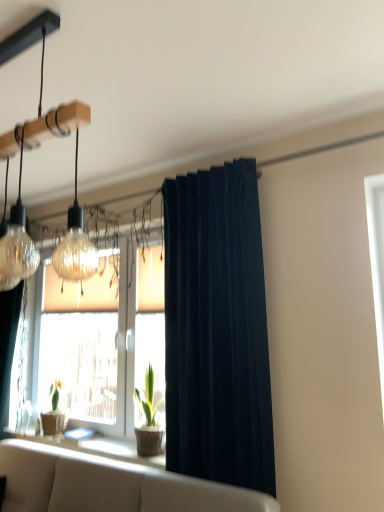
What do you see at coordinates (148, 420) in the screenshot?
I see `green matte plant at center` at bounding box center [148, 420].

Measure the distance between point (55, 118) and camera.

Point (55, 118) and camera are 3.97 feet apart from each other.

Identify the location of wooden textured window sill at lower center. (100, 448).

How many degrees apart are the facing directions of beige fabric couch at lower center and translucent glass window at center?

There is a 1.02-degree angle between the facing directions of beige fabric couch at lower center and translucent glass window at center.

Is beige fabric couch at lower center bigger than translucent glass window at center?

Yes.

Is beige fabric couch at lower center oriented towards translucent glass window at center?

No, beige fabric couch at lower center is not aimed at translucent glass window at center.

Can you confirm if beige fabric couch at lower center is thinner than translucent glass window at center?

No.

Is translucent glass window at center inside matte glass pendant light at upper left?

Actually, translucent glass window at center is outside matte glass pendant light at upper left.

Is matte glass pendant light at upper left bigger or smaller than translucent glass window at center?

matte glass pendant light at upper left is smaller than translucent glass window at center.

In the image, is matte glass pendant light at upper left on the left side or the right side of translucent glass window at center?

Based on their positions, matte glass pendant light at upper left is located to the right of translucent glass window at center.

Is matte glass pendant light at upper left positioned behind translucent glass window at center?

No, the depth of matte glass pendant light at upper left is less than that of translucent glass window at center.

Is dark blue velvet curtain at center turned away from beige fabric couch at lower center?

That's not correct — dark blue velvet curtain at center is not looking away from beige fabric couch at lower center.

Considering the positions of objects dark blue velvet curtain at center and beige fabric couch at lower center in the image provided, who is more to the left, dark blue velvet curtain at center or beige fabric couch at lower center?

Positioned to the left is beige fabric couch at lower center.

Who is bigger, wooden textured window sill at lower center or dark blue velvet curtain at center?

dark blue velvet curtain at center is bigger.

Is wooden textured window sill at lower center wider or thinner than dark blue velvet curtain at center?

wooden textured window sill at lower center is wider than dark blue velvet curtain at center.

From the image's perspective, between wooden textured window sill at lower center and dark blue velvet curtain at center, who is located below?

From the image's view, wooden textured window sill at lower center is below.

The image size is (384, 512). In the image, there is a dark blue velvet curtain at center. In order to click on lamp above it (from the image's perspective) in this screenshot , I will do `click(30, 149)`.

Is dark blue velvet curtain at center wider than matte glass pendant light at upper left?

Incorrect, the width of dark blue velvet curtain at center does not surpass that of matte glass pendant light at upper left.

Is dark blue velvet curtain at center completely or partially outside of matte glass pendant light at upper left?

Indeed, dark blue velvet curtain at center is completely outside matte glass pendant light at upper left.

Looking at this image, would you consider dark blue velvet curtain at center to be distant from matte glass pendant light at upper left?

Indeed, dark blue velvet curtain at center is not near matte glass pendant light at upper left.

Considering the relative positions of translucent glass window at center and wooden textured window sill at lower center in the image provided, is translucent glass window at center behind wooden textured window sill at lower center?

Yes, it is behind wooden textured window sill at lower center.

Is translucent glass window at center facing away from wooden textured window sill at lower center?

No, translucent glass window at center is not facing away from wooden textured window sill at lower center.

Between translucent glass window at center and wooden textured window sill at lower center, which one has smaller size?

Smaller between the two is wooden textured window sill at lower center.

Considering the sizes of translucent glass window at center and wooden textured window sill at lower center in the image, is translucent glass window at center taller or shorter than wooden textured window sill at lower center?

In the image, translucent glass window at center appears to be taller than wooden textured window sill at lower center.

Is matte glass pendant light at upper left looking in the opposite direction of wooden textured window sill at lower center?

No.

Does matte glass pendant light at upper left contain wooden textured window sill at lower center?

No, wooden textured window sill at lower center is not surrounded by matte glass pendant light at upper left.

Which point is more forward, (35, 37) or (85, 440)?

The point (35, 37) is closer to the camera.

Locate an element on the screen. Image resolution: width=384 pixels, height=512 pixels. window lying on the left of beige fabric couch at lower center is located at coordinates 105,341.

The width and height of the screenshot is (384, 512). I want to click on lamp that is above the translucent glass window at center (from a real-world perspective), so click(x=30, y=149).

Looking at the image, which one is located further to translucent glass window at center, beige fabric couch at lower center or green matte plant at center?

beige fabric couch at lower center is further to translucent glass window at center.

Looking at the image, which one is located further to translucent glass window at center, matte glass pendant light at upper left or wooden textured window sill at lower center?

Based on the image, matte glass pendant light at upper left appears to be further to translucent glass window at center.

Estimate the real-world distances between objects in this image. Which object is closer to dark blue velvet curtain at center, wooden textured window sill at lower center or green matte plant at center?

green matte plant at center lies closer to dark blue velvet curtain at center than the other object.

Looking at the image, which one is located closer to green matte plant at center, wooden textured window sill at lower center or matte glass pendant light at upper left?

wooden textured window sill at lower center.

From the picture: Estimate the real-world distances between objects in this image. Which object is closer to wooden textured window sill at lower center, beige fabric couch at lower center or matte glass pendant light at upper left?

Based on the image, beige fabric couch at lower center appears to be nearer to wooden textured window sill at lower center.

Based on their spatial positions, is matte glass pendant light at upper left or translucent glass window at center closer to green matte plant at center?

translucent glass window at center is positioned closer to the anchor green matte plant at center.

Estimate the real-world distances between objects in this image. Which object is further from beige fabric couch at lower center, wooden textured window sill at lower center or matte glass pendant light at upper left?

matte glass pendant light at upper left.

From the image, which object appears to be farther from wooden textured window sill at lower center, translucent glass window at center or matte glass pendant light at upper left?

Among the two, matte glass pendant light at upper left is located further to wooden textured window sill at lower center.

Where is `curtain between beige fabric couch at lower center and green matte plant at center along the z-axis`? This screenshot has width=384, height=512. curtain between beige fabric couch at lower center and green matte plant at center along the z-axis is located at coordinates (217, 329).

Find the location of `houseplant between matte glass pendant light at upper left and wooden textured window sill at lower center from front to back`. houseplant between matte glass pendant light at upper left and wooden textured window sill at lower center from front to back is located at coordinates (148, 420).

This screenshot has width=384, height=512. In order to click on window between dark blue velvet curtain at center and wooden textured window sill at lower center from top to bottom in this screenshot , I will do `click(105, 341)`.

Identify the location of curtain between matte glass pendant light at upper left and green matte plant at center in the front-back direction. (217, 329).